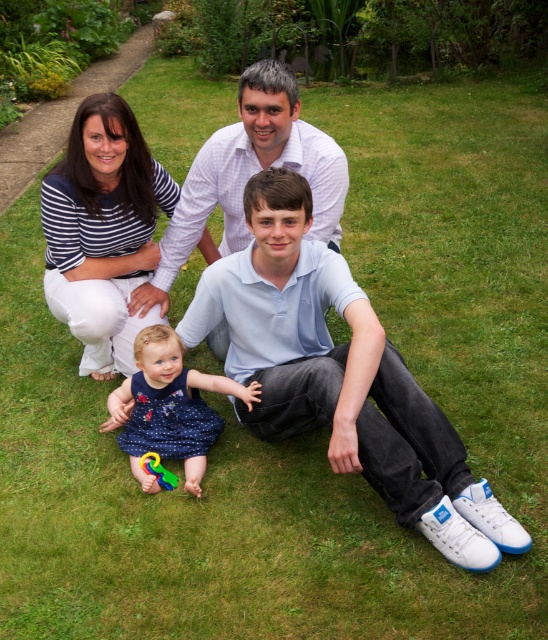
At what (x,y) coordinates should I click in order to perform the action: click on white cotton shirt at center. Please return your answer as a coordinate pair (x, y). Looking at the image, I should click on (340, 376).

Does point (355, 442) lie in front of point (161, 464)?

Yes.

Where is `white cotton shirt at center`? This screenshot has width=548, height=640. white cotton shirt at center is located at coordinates (340, 376).

Can you confirm if white cotton shirt at center is positioned below striped cotton shirt at center?

Yes, white cotton shirt at center is below striped cotton shirt at center.

Identify the location of white cotton shirt at center. This screenshot has height=640, width=548. 340,376.

Which is above, white cotton shirt at center or dark blue satin dress at center?

Positioned higher is white cotton shirt at center.

Does point (345, 353) come in front of point (167, 449)?

Yes, point (345, 353) is in front of point (167, 449).

Is point (379, 452) positioned before point (179, 353)?

Yes, point (379, 452) is closer to viewer.

Where is `white cotton shirt at center`? white cotton shirt at center is located at coordinates (340, 376).